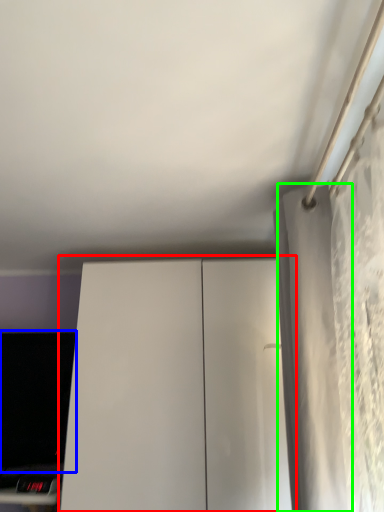
Question: Which object is the closest to the dresser (highlighted by a red box)? Choose among these: computer monitor (highlighted by a blue box) or curtain (highlighted by a green box).

Choices:
 (A) computer monitor
 (B) curtain

Answer: (A)